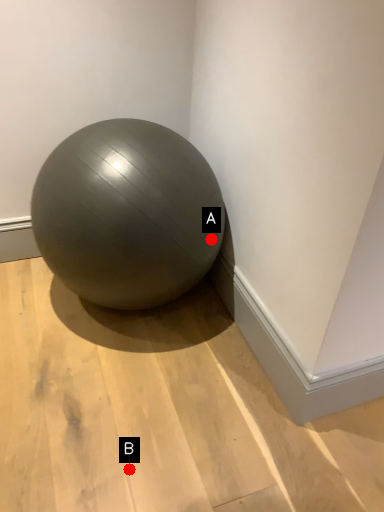
Question: Two points are circled on the image, labeled by A and B beside each circle. Which point is farther from the camera taking this photo?

Choices:
 (A) A is further
 (B) B is further

Answer: (A)